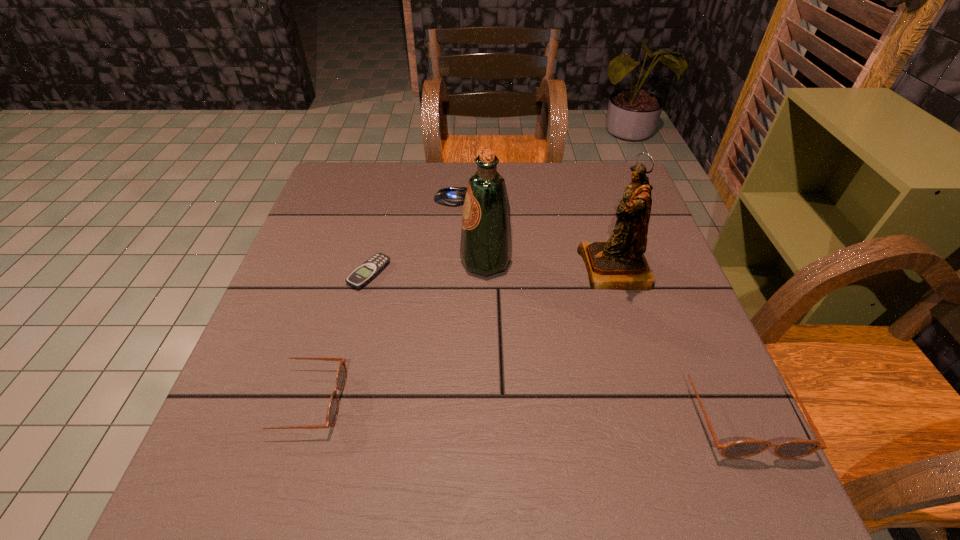
To achieve even spacing by inserting another sunglasses among them, please point to a vacant spot for this new sunglasses. Please provide its 2D coordinates. Your answer should be formatted as a tuple, i.e. [(x, y)], where the tuple contains the x and y coordinates of a point satisfying the conditions above.

[(519, 405)]